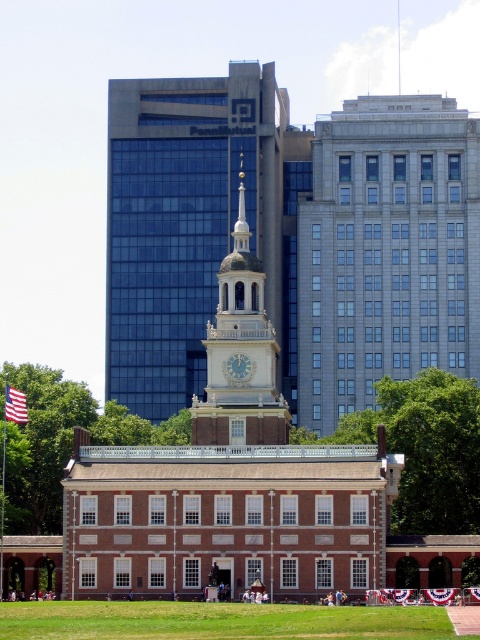
Question: Among these points, which one is nearest to the camera?

Choices:
 (A) (151, 234)
 (B) (444, 620)
 (C) (231, 378)

Answer: (B)

Question: Observing the image, what is the correct spatial positioning of white glossy clock at center in reference to red fabric flag at lower left?

Choices:
 (A) below
 (B) above

Answer: (B)

Question: From the image, what is the correct spatial relationship of green leafy tree at center in relation to green leafy tree at lower left?

Choices:
 (A) left
 (B) right

Answer: (B)

Question: Is gold-plated clock tower at center positioned before green leafy tree at lower left?

Choices:
 (A) yes
 (B) no

Answer: (B)

Question: Which of the following is the closest to the observer?

Choices:
 (A) green grass at lower center
 (B) gold-plated clock tower at center
 (C) green leafy tree at lower left

Answer: (A)

Question: Which of the following is the farthest from the observer?

Choices:
 (A) (248, 371)
 (B) (240, 346)

Answer: (B)